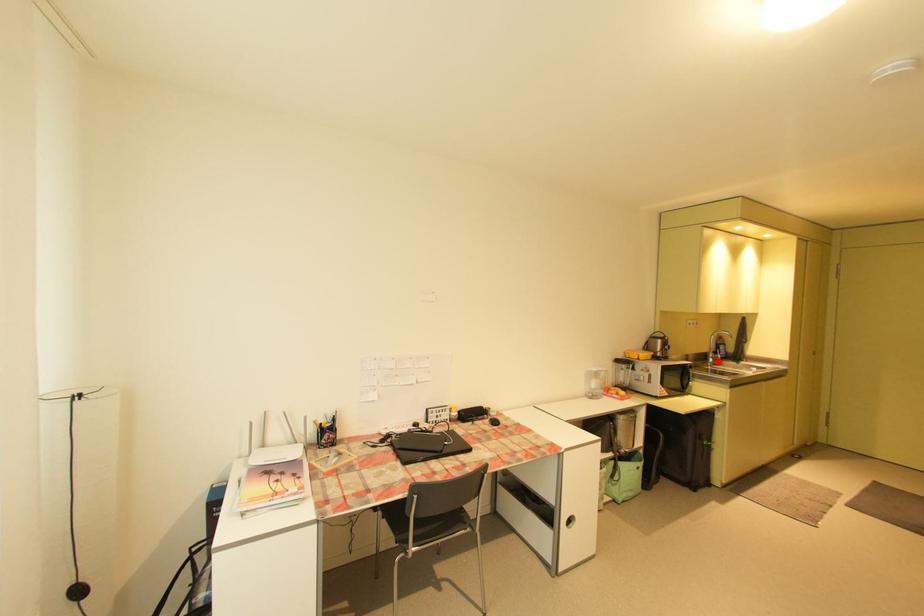
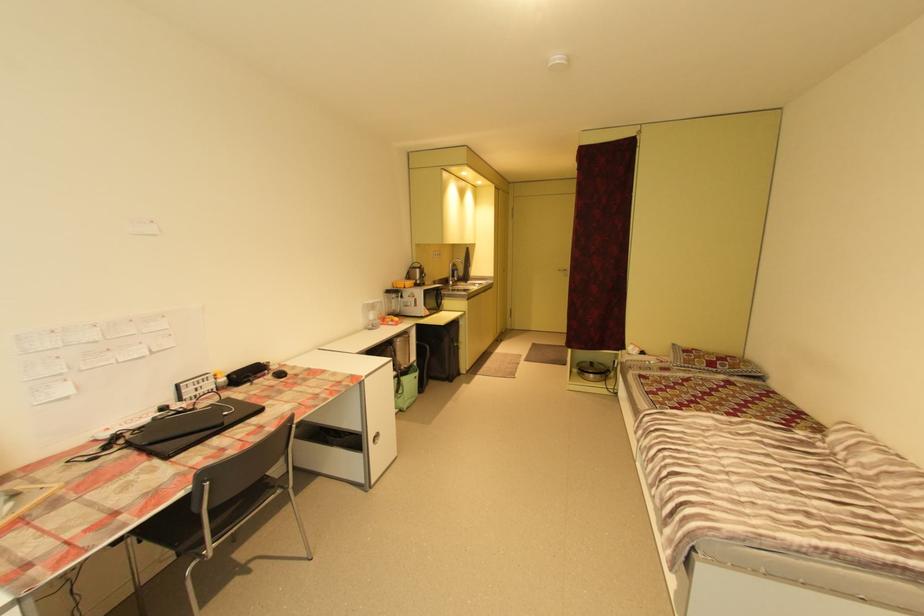
Question: I am providing you with two images of the same scene from different viewpoints. Given a red point in image1, look at the same physical point in image2. Is it:

Choices:
 (A) Closer to the viewpoint
 (B) Farther from the viewpoint

Answer: (A)